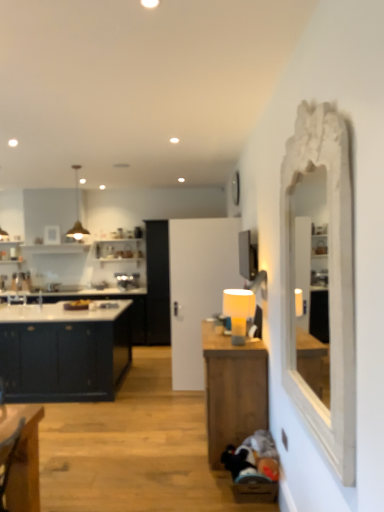
Question: Does point (251, 314) appear closer or farther from the camera than point (109, 346)?

Choices:
 (A) farther
 (B) closer

Answer: (B)

Question: From a real-world perspective, is matte yellow lampshade at center-right above or below matte dark blue cabinet at left?

Choices:
 (A) above
 (B) below

Answer: (A)

Question: Which is farther from the white carved mirror at right?

Choices:
 (A) wooden table at center
 (B) metallic pendant light at upper left
 (C) matte dark blue cabinet at left
 (D) matte yellow lampshade at center-right

Answer: (B)

Question: Estimate the real-world distances between objects in this image. Which object is farther from the white carved mirror at right?

Choices:
 (A) matte yellow lampshade at center-right
 (B) matte dark blue cabinet at left
 (C) metallic pendant light at upper left
 (D) wooden table at center

Answer: (C)